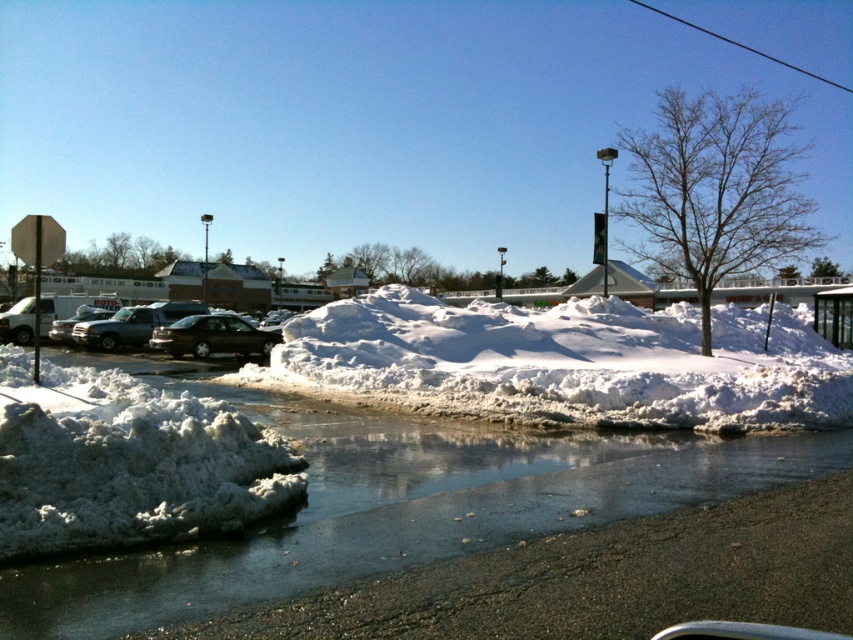
Who is more distant from viewer, (415, 560) or (596, 339)?

Point (596, 339)

Does point (602, 481) lie in front of point (582, 397)?

Yes, it is.

Is point (821, 470) closer to viewer compared to point (672, 369)?

Yes, point (821, 470) is closer to viewer.

I want to click on white frothy foam at lower left, so click(x=397, y=508).

Which is below, white fluffy snow at center or shiny black sedan at center?

shiny black sedan at center

How far apart are white fluffy snow at center and shiny black sedan at center?

The distance of white fluffy snow at center from shiny black sedan at center is 44.30 feet.

Is point (469, 310) positioned before point (204, 323)?

Yes.

This screenshot has height=640, width=853. In order to click on white fluffy snow at center in this screenshot , I will do `click(567, 364)`.

Is white fluffy snow at center wider than white fluffy snow at lower left?

Correct, the width of white fluffy snow at center exceeds that of white fluffy snow at lower left.

Who is lower down, white fluffy snow at center or white fluffy snow at lower left?

white fluffy snow at lower left

Locate an element on the screen. The width and height of the screenshot is (853, 640). white fluffy snow at center is located at coordinates (567, 364).